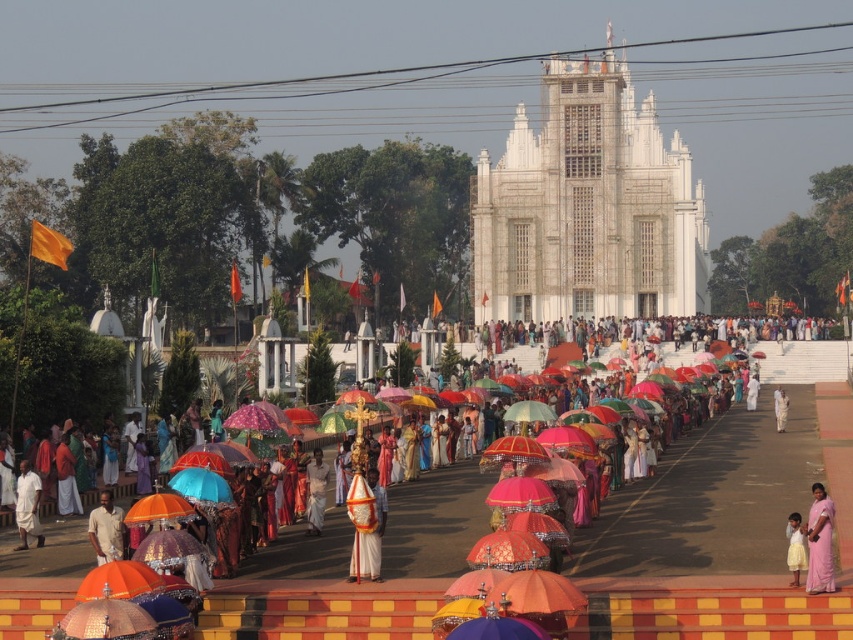
In the scene, there are multicolored umbrellas at center and a white stone temple at center. From the perspective of someone standing at the entrance of the temple, which object is positioned to the right?

The white stone temple at center is to the right of the multicolored umbrellas at center from the perspective of someone standing at the entrance of the temple.

Looking at this image, you are standing at the center of the pathway lined with colorful umbrellas in the religious procession scene. There are two points marked on the path ahead of you at coordinates point (819, 525) and point (788, 568). Which point is closer to your current position?

Point (819, 525) is closer to the viewer than point (788, 568), so the point at (819, 525) is closer to your current position.